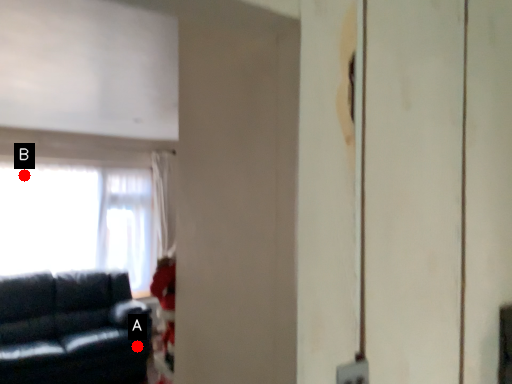
Question: Two points are circled on the image, labeled by A and B beside each circle. Among these points, which one is farthest from the camera?

Choices:
 (A) A is further
 (B) B is further

Answer: (B)